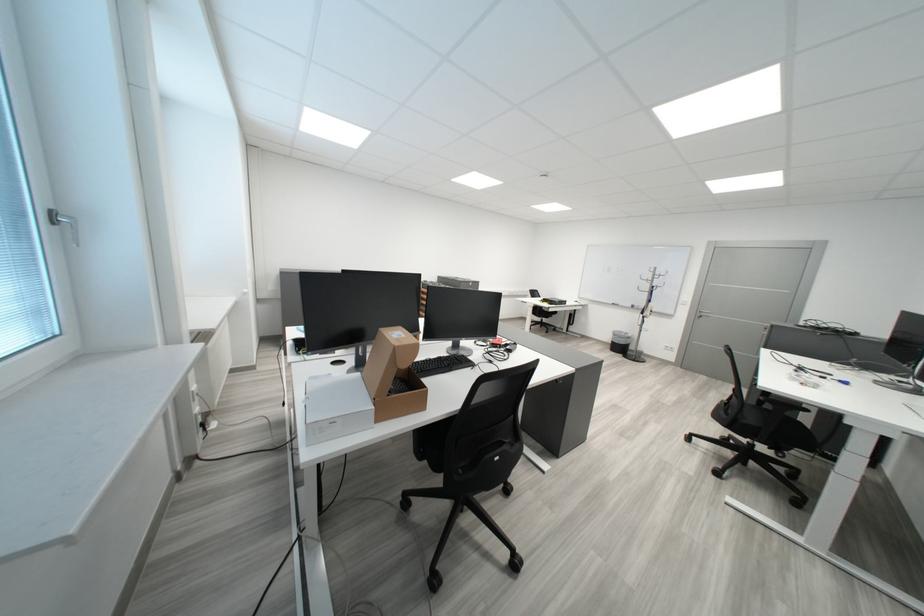
Where would you pull the silver window handle? Please return your answer as a coordinate pair (x, y).

(73, 230)